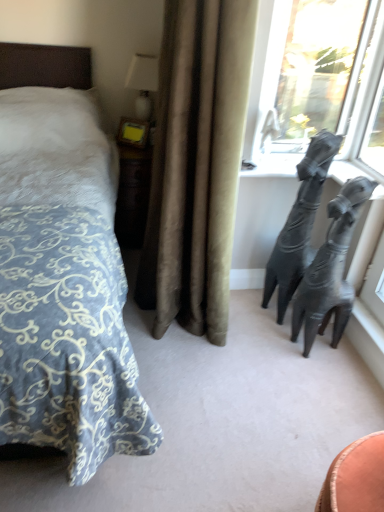
What do you see at coordinates (313, 76) in the screenshot? The image size is (384, 512). I see `transparent glass window at upper right` at bounding box center [313, 76].

At what (x,y) coordinates should I click in order to perform the action: click on shiny metallic sculpture at right. Please return your answer as a coordinate pair (x, y). This screenshot has width=384, height=512. Looking at the image, I should click on (330, 269).

The width and height of the screenshot is (384, 512). Find the location of `velvet beige curtain at center`. velvet beige curtain at center is located at coordinates (196, 164).

What are the coordinates of `white glossy table lamp at upper center` in the screenshot? It's located at (143, 82).

This screenshot has height=512, width=384. In order to click on blue patterned fabric bed at left in this screenshot , I will do `click(63, 269)`.

The image size is (384, 512). I want to click on table lamp above the transparent glass window at upper right (from the image's perspective), so click(143, 82).

How much distance is there between transparent glass window at upper right and white glossy table lamp at upper center?

A distance of 38.24 inches exists between transparent glass window at upper right and white glossy table lamp at upper center.

In terms of width, does transparent glass window at upper right look wider or thinner when compared to white glossy table lamp at upper center?

Considering their sizes, transparent glass window at upper right looks slimmer than white glossy table lamp at upper center.

From a real-world perspective, is white glossy table lamp at upper center physically located above or below shiny metallic sculpture at right?

From a real-world perspective, white glossy table lamp at upper center is physically above shiny metallic sculpture at right.

Is white glossy table lamp at upper center looking in the opposite direction of shiny metallic sculpture at right?

white glossy table lamp at upper center does not have its back to shiny metallic sculpture at right.

Between point (150, 60) and point (331, 342), which one is positioned in front?

The point (331, 342) is more forward.

In the scene shown: Does white glossy table lamp at upper center have a lesser height compared to shiny metallic sculpture at right?

Correct, white glossy table lamp at upper center is not as tall as shiny metallic sculpture at right.

Considering the relative sizes of velvet beige curtain at center and white glossy table lamp at upper center in the image provided, is velvet beige curtain at center bigger than white glossy table lamp at upper center?

Yes.

Is point (248, 41) less distant than point (147, 106)?

Yes, point (248, 41) is in front of point (147, 106).

Considering the sizes of objects velvet beige curtain at center and white glossy table lamp at upper center in the image provided, who is taller, velvet beige curtain at center or white glossy table lamp at upper center?

Standing taller between the two is velvet beige curtain at center.

Find the location of `bronze sculpture below the transparent glass window at upper right (from the image's perspective)`. bronze sculpture below the transparent glass window at upper right (from the image's perspective) is located at coordinates (330, 269).

Which of these two, transparent glass window at upper right or shiny metallic sculpture at right, is wider?

shiny metallic sculpture at right is wider.

From the image's perspective, between transparent glass window at upper right and shiny metallic sculpture at right, who is located below?

From the image's view, shiny metallic sculpture at right is below.

Would you say transparent glass window at upper right is a long distance from shiny metallic sculpture at right?

transparent glass window at upper right is near shiny metallic sculpture at right, not far away.

Considering the sizes of transparent glass window at upper right and blue patterned fabric bed at left in the image, is transparent glass window at upper right wider or thinner than blue patterned fabric bed at left?

transparent glass window at upper right is thinner than blue patterned fabric bed at left.

From a real-world perspective, is transparent glass window at upper right positioned under blue patterned fabric bed at left based on gravity?

Incorrect, from a real-world perspective, transparent glass window at upper right is higher than blue patterned fabric bed at left.

Looking at the image, does transparent glass window at upper right seem bigger or smaller compared to blue patterned fabric bed at left?

transparent glass window at upper right is smaller than blue patterned fabric bed at left.

Is transparent glass window at upper right facing away from blue patterned fabric bed at left?

No, transparent glass window at upper right is not facing away from blue patterned fabric bed at left.

Is blue patterned fabric bed at left located outside velvet beige curtain at center?

Yes, blue patterned fabric bed at left is located beyond the bounds of velvet beige curtain at center.

Could you tell me if blue patterned fabric bed at left is turned towards velvet beige curtain at center?

No, blue patterned fabric bed at left is not facing towards velvet beige curtain at center.

Considering the sizes of objects blue patterned fabric bed at left and velvet beige curtain at center in the image provided, who is wider, blue patterned fabric bed at left or velvet beige curtain at center?

blue patterned fabric bed at left.

Which object is wider, velvet beige curtain at center or black matte giraffe at right?

velvet beige curtain at center.

Is velvet beige curtain at center oriented away from black matte giraffe at right?

Yes, velvet beige curtain at center's orientation is away from black matte giraffe at right.

From a real-world perspective, between velvet beige curtain at center and black matte giraffe at right, who is vertically lower?

From a 3D spatial view, black matte giraffe at right is below.

Are velvet beige curtain at center and black matte giraffe at right beside each other?

They are not placed beside each other.

Identify the location of table lamp below the transparent glass window at upper right (from a real-world perspective). The height and width of the screenshot is (512, 384). (143, 82).

In the image, there is a shiny metallic sculpture at right. Identify the location of table lamp above it (from the image's perspective). This screenshot has height=512, width=384. (143, 82).

Based on their spatial positions, is black matte giraffe at right or shiny metallic sculpture at right closer to velvet beige curtain at center?

black matte giraffe at right.

Based on their spatial positions, is shiny metallic sculpture at right or blue patterned fabric bed at left closer to velvet beige curtain at center?

The object closer to velvet beige curtain at center is blue patterned fabric bed at left.

Looking at the image, which one is located closer to black matte giraffe at right, velvet beige curtain at center or transparent glass window at upper right?

Based on the image, transparent glass window at upper right appears to be nearer to black matte giraffe at right.

Based on their spatial positions, is white glossy table lamp at upper center or black matte giraffe at right closer to transparent glass window at upper right?

black matte giraffe at right is positioned closer to the anchor transparent glass window at upper right.

From the image, which object appears to be farther from white glossy table lamp at upper center, black matte giraffe at right or velvet beige curtain at center?

black matte giraffe at right.

When comparing their distances from shiny metallic sculpture at right, does white glossy table lamp at upper center or transparent glass window at upper right seem closer?

Based on the image, transparent glass window at upper right appears to be nearer to shiny metallic sculpture at right.

Looking at the image, which one is located further to velvet beige curtain at center, blue patterned fabric bed at left or white glossy table lamp at upper center?

white glossy table lamp at upper center.

Based on their spatial positions, is velvet beige curtain at center or transparent glass window at upper right closer to shiny metallic sculpture at right?

Based on the image, velvet beige curtain at center appears to be nearer to shiny metallic sculpture at right.

Locate an element on the screen. animal between velvet beige curtain at center and white glossy table lamp at upper center from front to back is located at coordinates (299, 224).

This screenshot has height=512, width=384. In order to click on animal between blue patterned fabric bed at left and shiny metallic sculpture at right from left to right in this screenshot , I will do `click(299, 224)`.

Locate an element on the screen. window positioned between blue patterned fabric bed at left and white glossy table lamp at upper center from near to far is located at coordinates (313, 76).

The height and width of the screenshot is (512, 384). Find the location of `window located between velvet beige curtain at center and white glossy table lamp at upper center in the depth direction`. window located between velvet beige curtain at center and white glossy table lamp at upper center in the depth direction is located at coordinates (313, 76).